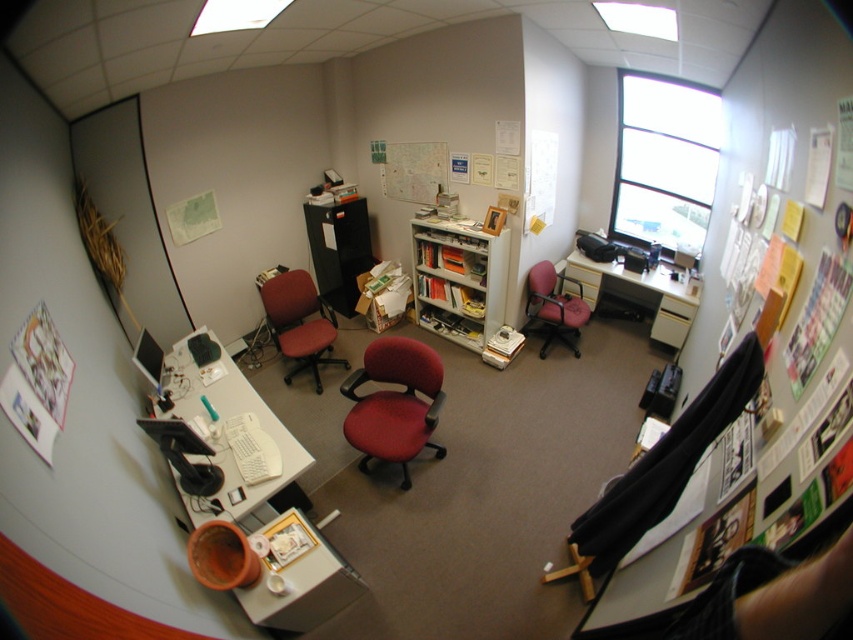
Question: Can you confirm if white glossy computer desk at lower left is smaller than pink fabric chair at center-right?

Choices:
 (A) no
 (B) yes

Answer: (A)

Question: Which point appears closest to the camera in this image?

Choices:
 (A) (329, 358)
 (B) (177, 360)
 (C) (399, 438)

Answer: (C)

Question: Estimate the real-world distances between objects in this image. Which object is farther from the matte white desk at center?

Choices:
 (A) matte red office chair at center
 (B) red fabric swivel chair at center
 (C) pink fabric chair at center-right

Answer: (B)

Question: Which point is closer to the camera taking this photo?

Choices:
 (A) (650, 301)
 (B) (273, 435)
 (C) (364, 362)

Answer: (B)

Question: Is red fabric swivel chair at center positioned behind matte white desk at center?

Choices:
 (A) no
 (B) yes

Answer: (A)

Question: Is matte white desk at center below pink fabric chair at center-right?

Choices:
 (A) yes
 (B) no

Answer: (B)